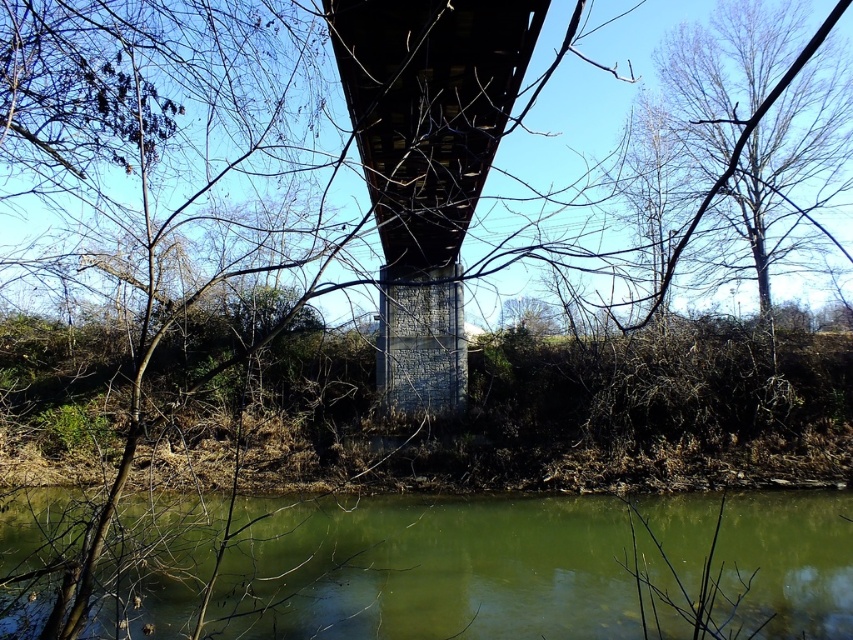
Question: Does green murky water at lower center appear on the right side of concrete bridge at center?

Choices:
 (A) yes
 (B) no

Answer: (A)

Question: Which of the following is the farthest from the observer?

Choices:
 (A) concrete bridge at center
 (B) green murky water at lower center

Answer: (B)

Question: Is green murky water at lower center bigger than concrete bridge at center?

Choices:
 (A) yes
 (B) no

Answer: (A)

Question: Is green murky water at lower center smaller than concrete bridge at center?

Choices:
 (A) no
 (B) yes

Answer: (A)